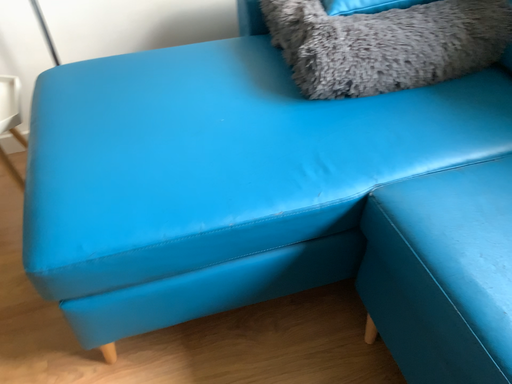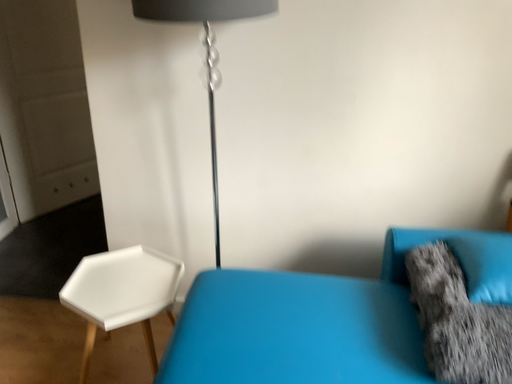
Question: How did the camera likely rotate when shooting the video?

Choices:
 (A) rotated upward
 (B) rotated downward

Answer: (A)